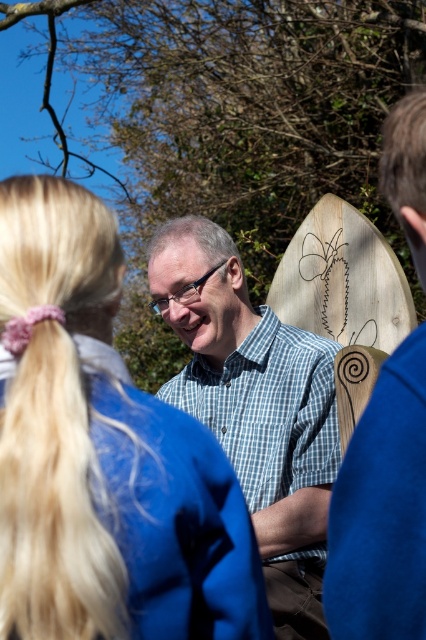
You are a photographer trying to capture a photo of the checkered fabric shirt at center and the wooden surfboard at right. Which object should you focus on first if you want to ensure both are in frame without moving the camera?

The checkered fabric shirt at center is bigger than the wooden surfboard at right, so you should focus on the checkered fabric shirt at center first to ensure it fits within the frame, then adjust to include the smaller wooden surfboard at right.

You are standing in the outdoor scene and want to walk from the point at coordinates point (11, 291) to the point at coordinates point (28, 518). Which direction should you move to get closer to your destination?

To move from point (11, 291) to point (28, 518), you should move towards the right and slightly forward since point (28, 518) is further away from the camera compared to point (11, 291).

You are a photographer trying to capture the best shot of the blonde hair at upper left and the wooden surfboard at right. Since you want to highlight both subjects equally, which one should you zoom in on more?

The blonde hair at upper left is bigger than the wooden surfboard at right, so you should zoom in more on the wooden surfboard at right to balance their sizes in the photo.